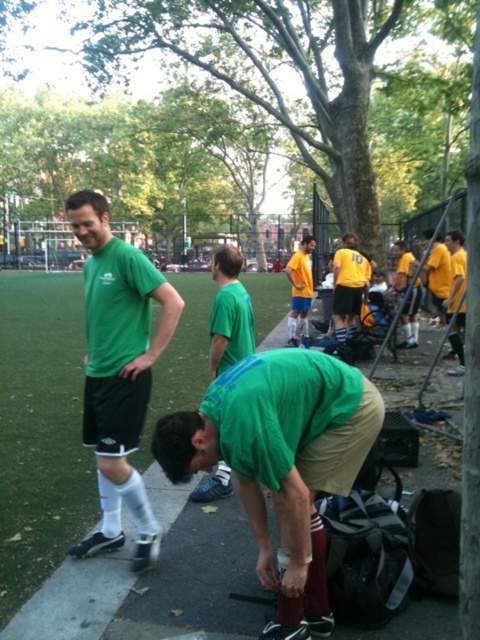
You are a photographer trying to capture a photo that includes both the yellow jersey at right and the yellow matte shirt at center. Based on their positions, which one will appear taller in the final image?

The yellow jersey at right has a greater height compared to the yellow matte shirt at center, so it will appear taller in the photo.